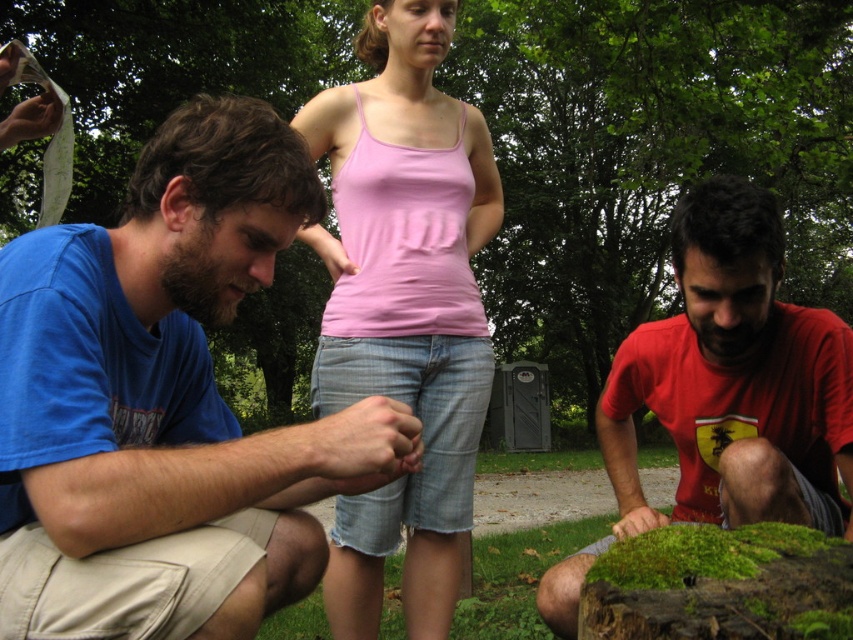
Question: Which object is closer to the camera taking this photo?

Choices:
 (A) red matte shirt at lower right
 (B) pink cotton tank top at center
 (C) blue cotton shirt at left

Answer: (C)

Question: Estimate the real-world distances between objects in this image. Which object is farther from the red matte shirt at lower right?

Choices:
 (A) pink cotton tank top at center
 (B) blue cotton shirt at left

Answer: (B)

Question: Is blue cotton shirt at left above red matte shirt at lower right?

Choices:
 (A) no
 (B) yes

Answer: (B)

Question: Does blue cotton shirt at left have a larger size compared to red matte shirt at lower right?

Choices:
 (A) yes
 (B) no

Answer: (B)

Question: Among these objects, which one is nearest to the camera?

Choices:
 (A) red matte shirt at lower right
 (B) blue cotton shirt at left
 (C) pink cotton tank top at center

Answer: (B)

Question: Is blue cotton shirt at left below pink cotton tank top at center?

Choices:
 (A) no
 (B) yes

Answer: (B)